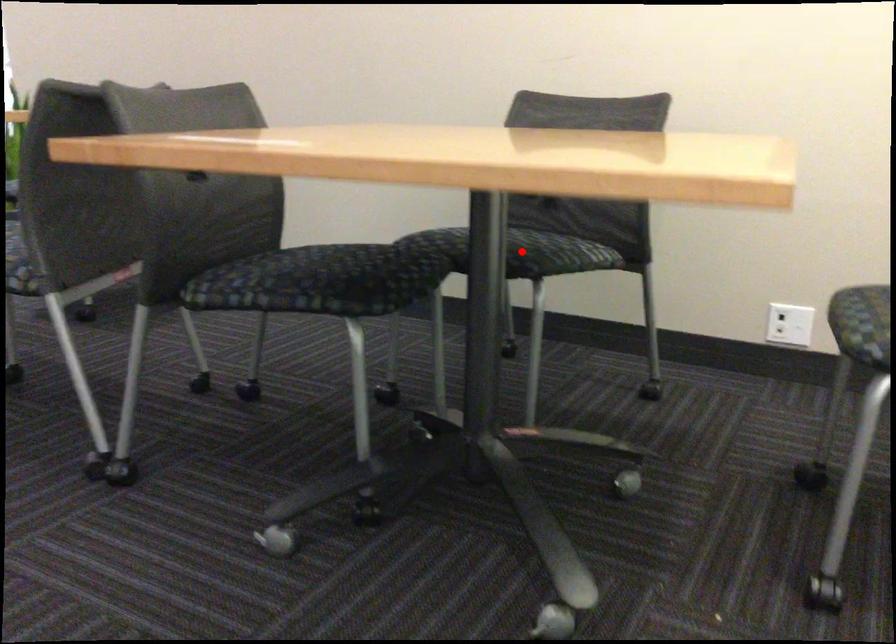
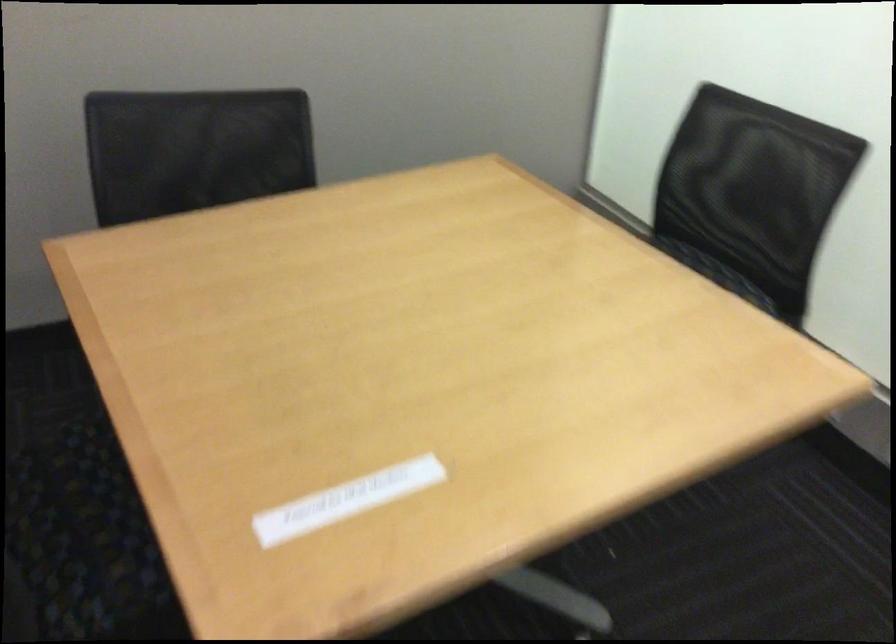
Question: I am providing you with two images of the same scene from different viewpoints. A red point is marked on the first image. Can you still see the location of the red point in image 2?

Choices:
 (A) Yes
 (B) No

Answer: (B)